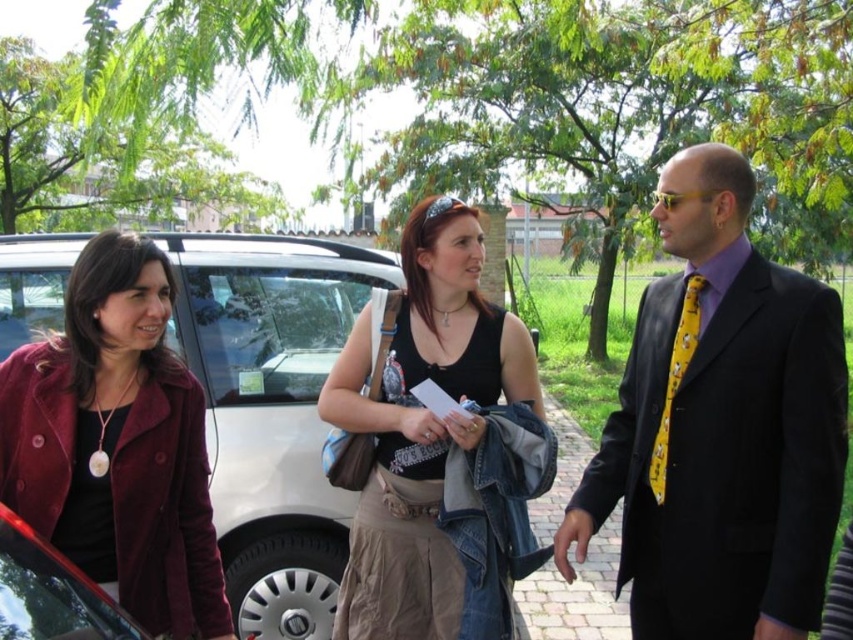
Is point (676, 326) closer to camera compared to point (376, 340)?

Yes.

Is matte black suit at center smaller than black fabric tank top at center?

Actually, matte black suit at center might be larger than black fabric tank top at center.

Looking at this image, measure the distance between matte black suit at center and camera.

matte black suit at center and camera are 1.82 meters apart from each other.

You are a GUI agent. You are given a task and a screenshot of the screen. Output one action in this format:
    pyautogui.click(x=<x>, y=<y>)
    Task: Click on the matte black suit at center
    This screenshot has height=640, width=853.
    Given the screenshot: What is the action you would take?
    pyautogui.click(x=720, y=428)

Does matte black suit at center have a lesser height compared to metallic red car at lower left?

No, matte black suit at center is not shorter than metallic red car at lower left.

This screenshot has width=853, height=640. What do you see at coordinates (720, 428) in the screenshot?
I see `matte black suit at center` at bounding box center [720, 428].

The image size is (853, 640). I want to click on matte black suit at center, so click(x=720, y=428).

Is point (212, 529) closer to camera compared to point (593, 563)?

That is True.

Can you confirm if velvet maroon coat at left is thinner than brick pavement at center?

Correct, velvet maroon coat at left's width is less than brick pavement at center's.

Is point (96, 513) in front of point (595, 588)?

Yes, point (96, 513) is in front of point (595, 588).

Where is `velvet maroon coat at left`? The height and width of the screenshot is (640, 853). velvet maroon coat at left is located at coordinates (117, 444).